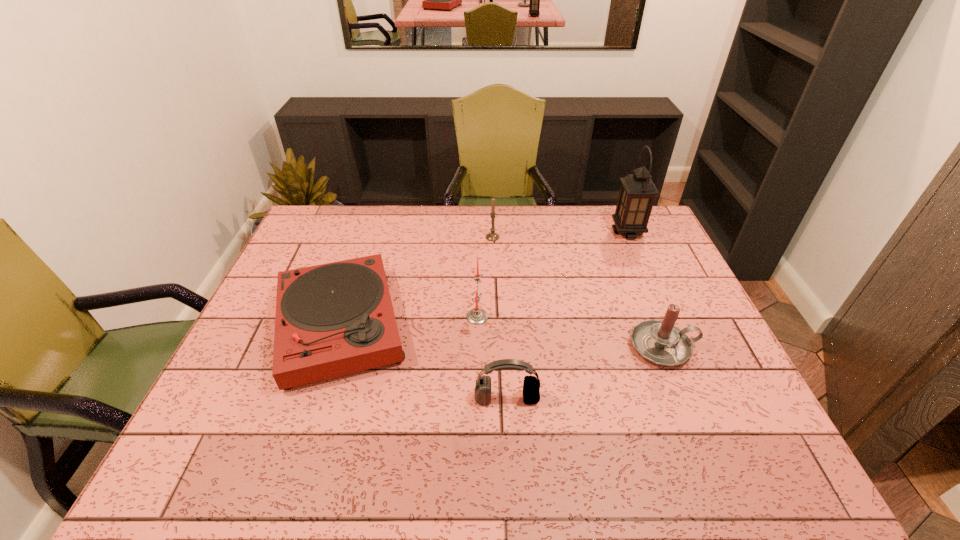
Locate an element on the screen. the tallest object is located at coordinates [637, 193].

The height and width of the screenshot is (540, 960). Find the location of `the farthest candle`. the farthest candle is located at coordinates (492, 236).

In order to click on the rightmost candle in this screenshot , I will do `click(660, 342)`.

What are the coordinates of `headset` in the screenshot? It's located at (531, 386).

Where is `the leftmost object`? This screenshot has width=960, height=540. the leftmost object is located at coordinates click(333, 319).

You are a GUI agent. You are given a task and a screenshot of the screen. Output one action in this format:
    pyautogui.click(x=<x>, y=<y>)
    Task: Click on the shortest object
    The width and height of the screenshot is (960, 540).
    Given the screenshot: What is the action you would take?
    click(x=333, y=319)

Where is `vacant space positioned 0.310m on the left of the tallest object`? vacant space positioned 0.310m on the left of the tallest object is located at coordinates (524, 232).

The image size is (960, 540). Identify the location of vacant space located 0.140m on the left of the farthest candle. (445, 237).

What are the coordinates of `free space located on the headband of the headset` in the screenshot? It's located at pos(508,426).

The height and width of the screenshot is (540, 960). Identify the location of vacant region located on the right of the record player. (437, 326).